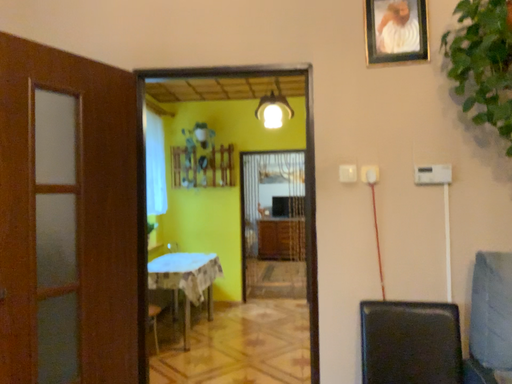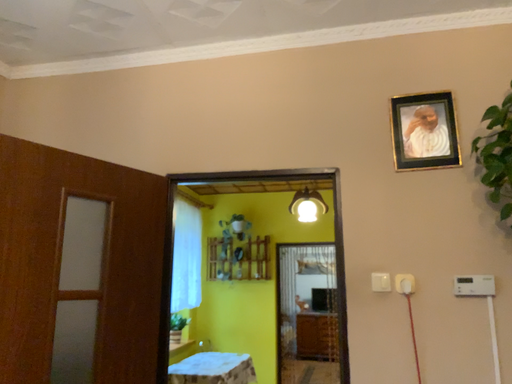
Question: How did the camera likely rotate when shooting the video?

Choices:
 (A) rotated upward
 (B) rotated downward

Answer: (A)